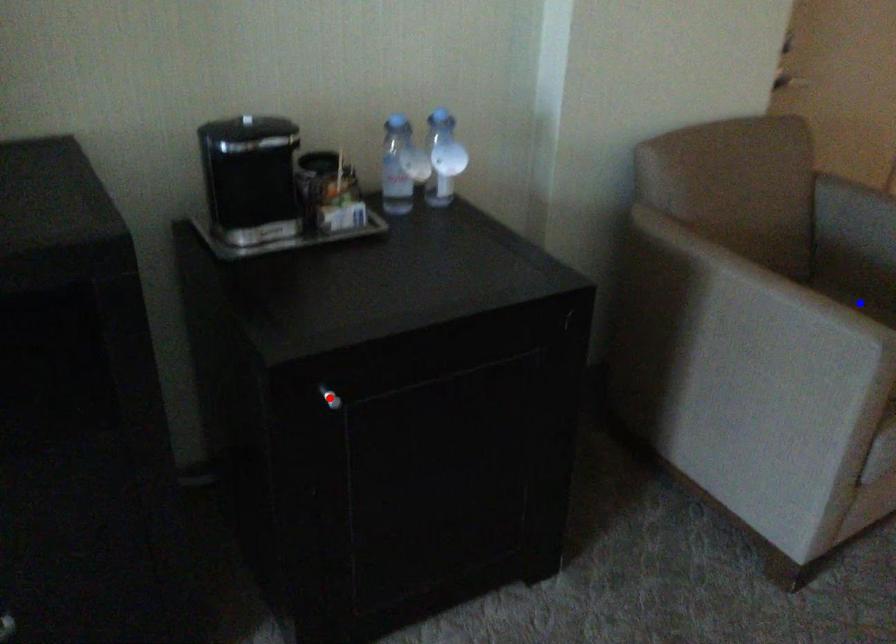
Question: In the image, two points are highlighted. Which point is nearer to the camera? Reply with the corresponding letter.

Choices:
 (A) blue point
 (B) red point

Answer: (B)